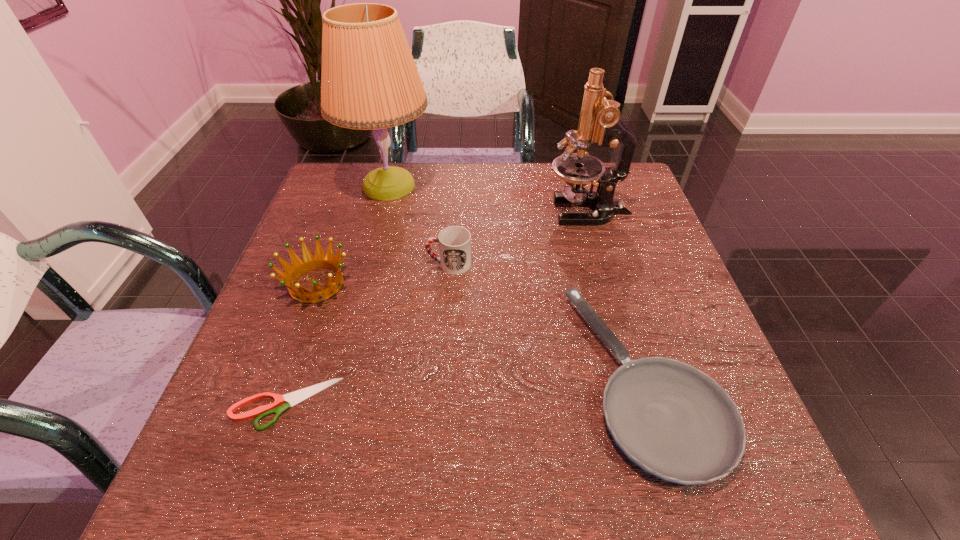
This screenshot has height=540, width=960. Find the location of `free space located 0.110m on the handle side of the cup`. free space located 0.110m on the handle side of the cup is located at coordinates (380, 264).

This screenshot has height=540, width=960. Identify the location of free space located on the handle side of the cup. (397, 264).

At what (x,y) coordinates should I click in order to perform the action: click on free space located 0.150m on the handle side of the cup. Please return your answer as a coordinate pair (x, y). The image size is (960, 540). Looking at the image, I should click on (363, 264).

Locate an element on the screen. vacant space located 0.120m on the back of the crown is located at coordinates (337, 227).

Find the location of a particular element. vacant space located on the left of the frying pan is located at coordinates (408, 378).

The image size is (960, 540). In order to click on free location located on the back of the shortest object in this screenshot , I will do `click(329, 275)`.

Where is `lamp at the far edge`? lamp at the far edge is located at coordinates (369, 80).

I want to click on microscope that is at the far edge, so click(x=600, y=122).

Find the location of a particular element. The width and height of the screenshot is (960, 540). object located in the near edge section of the desktop is located at coordinates (675, 422).

Image resolution: width=960 pixels, height=540 pixels. I want to click on lamp present at the left edge, so click(369, 80).